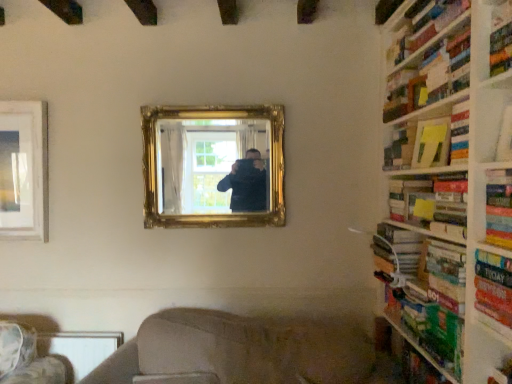
Where is `empty space that is ontop of metallic silver table at lower left (from a real-world perspective)`? empty space that is ontop of metallic silver table at lower left (from a real-world perspective) is located at coordinates click(79, 331).